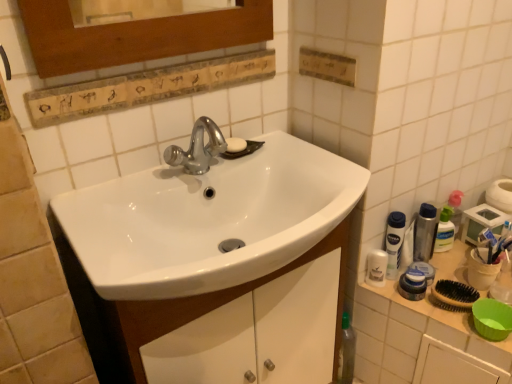
Question: Is white matte toothpaste at right wider or thinner than white glossy sink at center?

Choices:
 (A) thin
 (B) wide

Answer: (A)

Question: Is white matte toothpaste at right to the left or to the right of white glossy sink at center in the image?

Choices:
 (A) right
 (B) left

Answer: (A)

Question: Estimate the real-world distances between objects in this image. Which object is farther from the translucent plastic mouthwash at right, the 5th mouthwash viewed from the left?

Choices:
 (A) white plastic mouthwash at right, the first mouthwash when ordered from left to right
 (B) translucent plastic mouthwash at right, which ranks as the 2th mouthwash in right-to-left order
 (C) white plastic container at right
 (D) white glossy sink at center
 (E) translucent plastic mouthwash at right, arranged as the 3th mouthwash when viewed from the left

Answer: (D)

Question: Which of these objects is positioned closest to the white plastic container at right?

Choices:
 (A) white glossy sink at center
 (B) translucent plastic mouthwash at right, the 3th mouthwash in the right-to-left sequence
 (C) translucent plastic mouthwash at right, the 5th mouthwash viewed from the left
 (D) white matte toothpaste at right
 (E) white plastic mouthwash at right, the 5th mouthwash positioned from the right

Answer: (B)